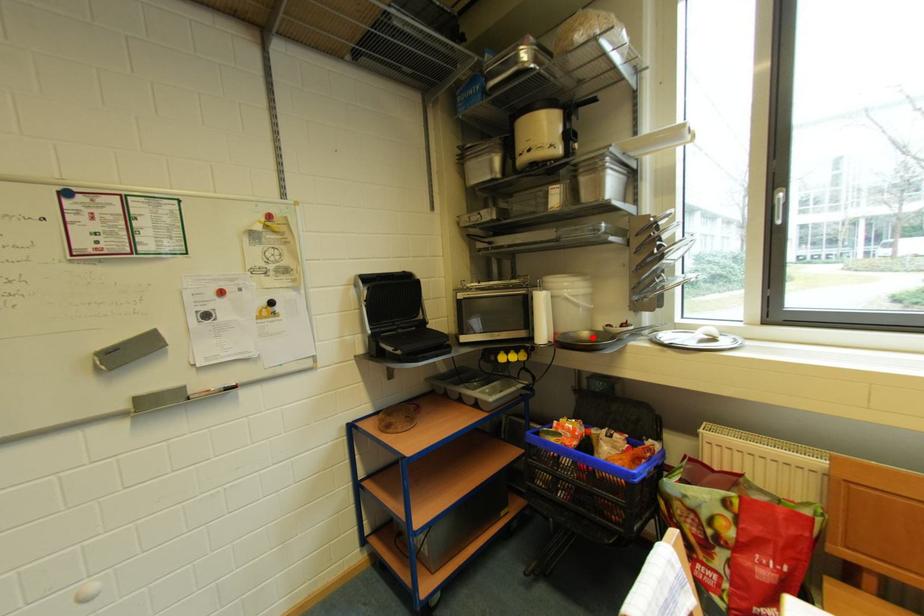
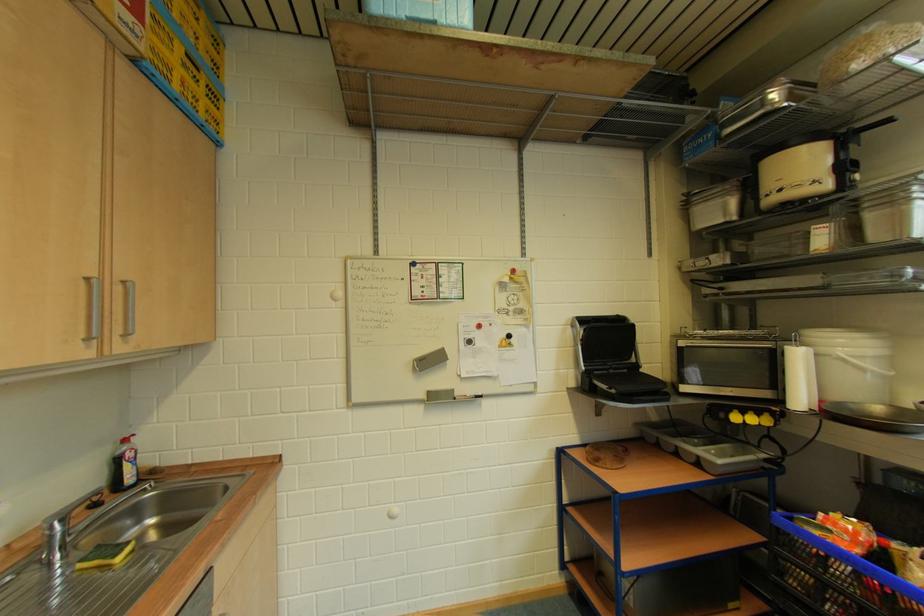
Question: I am providing you with two images of the same scene from different viewpoints. A red point is marked on the first image. Is the red point's position out of view in image 2?

Choices:
 (A) Yes
 (B) No

Answer: (B)